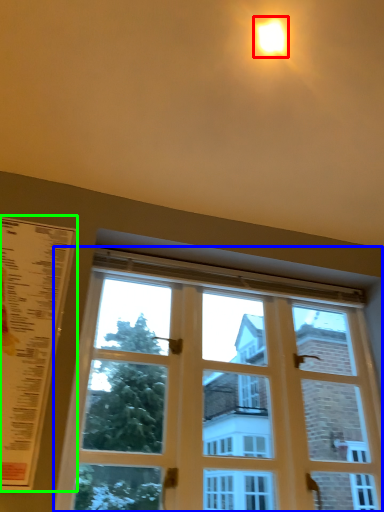
Question: Based on their relative distances, which object is nearer to light (highlighted by a red box)? Choose from window (highlighted by a blue box) and menu (highlighted by a green box).

Choices:
 (A) window
 (B) menu

Answer: (B)